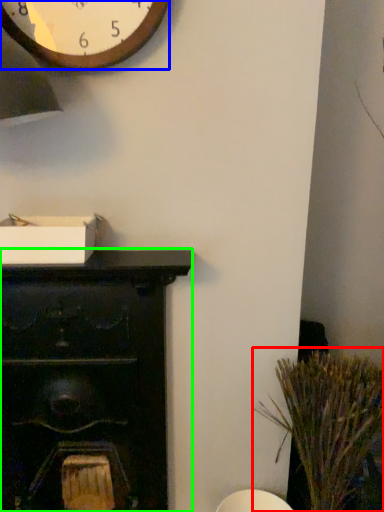
Question: Which is farther away from plant (highlighted by a red box)? wall clock (highlighted by a blue box) or furniture (highlighted by a green box)?

Choices:
 (A) wall clock
 (B) furniture

Answer: (A)